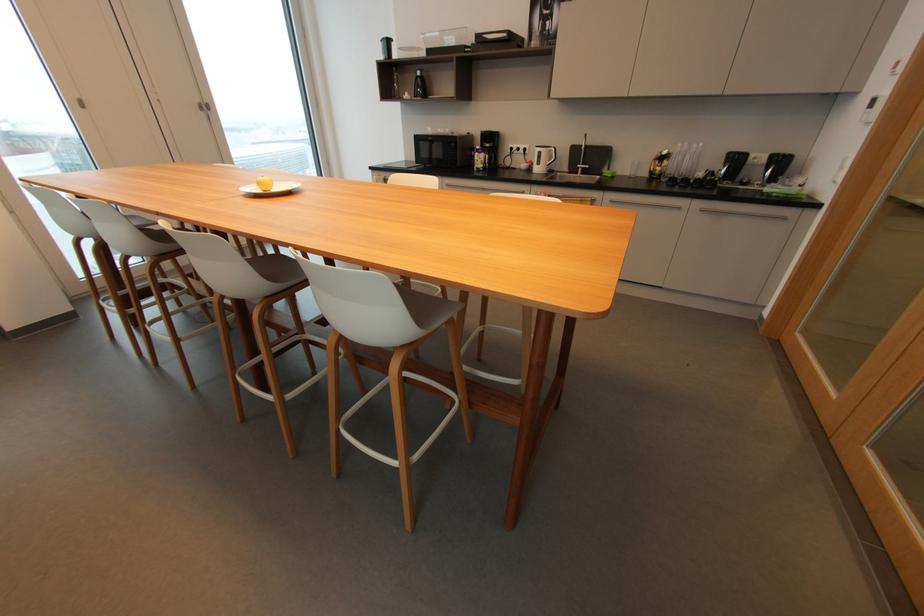
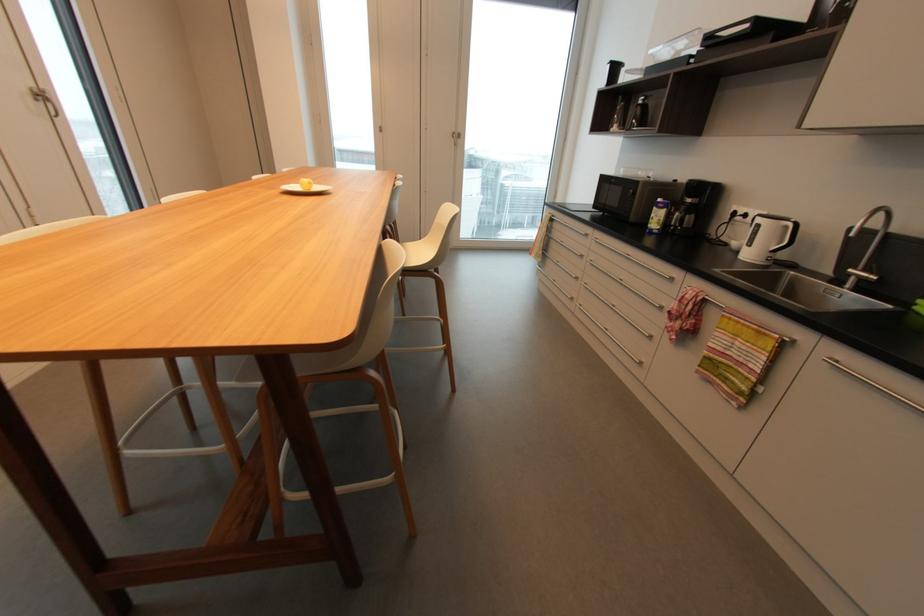
In the second image, find the point that corresponds to point 581,166 in the first image.

(854, 270)